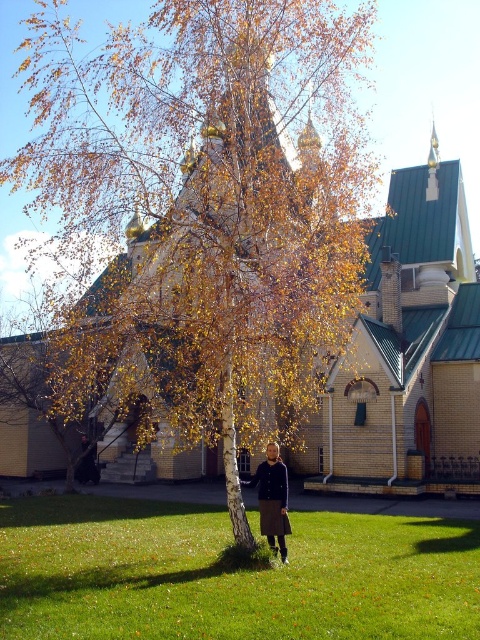
Describe the element at coordinates (228, 576) in the screenshot. The height and width of the screenshot is (640, 480). I see `green grass at lower center` at that location.

Locate an element on the screen. green grass at lower center is located at coordinates (x=228, y=576).

From the picture: Can you confirm if golden brick church at center is wider than dark brown leather jacket at center?

Yes.

Is golden brick church at center to the right of dark brown leather jacket at center from the viewer's perspective?

Indeed, golden brick church at center is positioned on the right side of dark brown leather jacket at center.

Locate an element on the screen. Image resolution: width=480 pixels, height=640 pixels. golden brick church at center is located at coordinates (409, 346).

Find the location of `golden brick church at center`. golden brick church at center is located at coordinates (409, 346).

Is point (303, 598) farther from camera compared to point (85, 476)?

No.

Where is `green grass at lower center`? green grass at lower center is located at coordinates (228, 576).